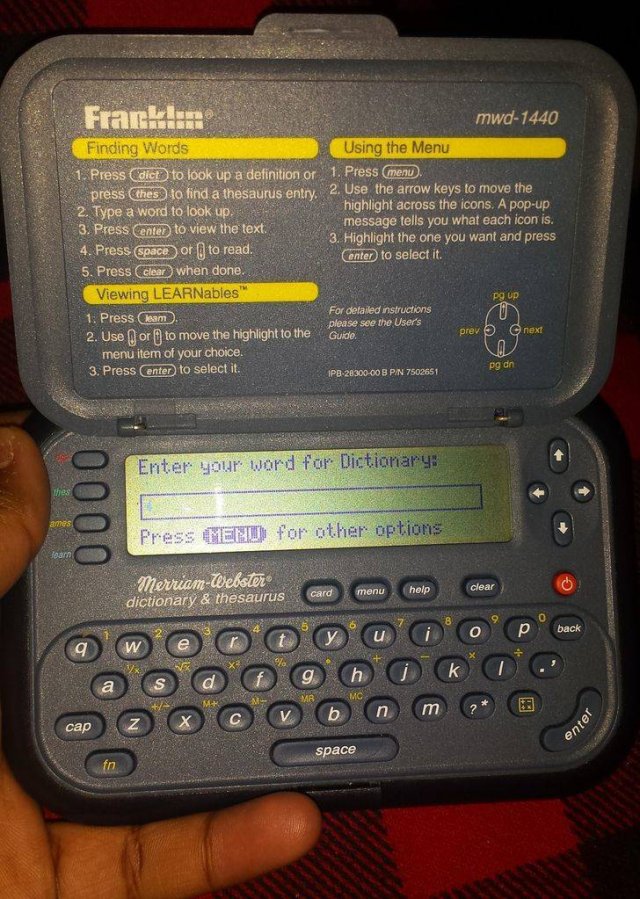
You are a GUI agent. You are given a task and a screenshot of the screen. Output one action in this format:
    pyautogui.click(x=<x>, y=<y>)
    Task: Click on the hinge
    The width and height of the screenshot is (640, 899).
    Given the screenshot: What is the action you would take?
    pyautogui.click(x=508, y=423), pyautogui.click(x=131, y=424)